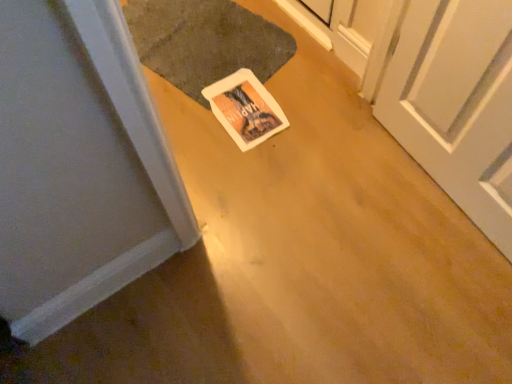
You are a GUI agent. You are given a task and a screenshot of the screen. Output one action in this format:
    pyautogui.click(x=<x>, y=<y>)
    Task: Click on the free space in front of white paper postcard at center
    This screenshot has height=384, width=512.
    Given the screenshot: What is the action you would take?
    pyautogui.click(x=243, y=164)